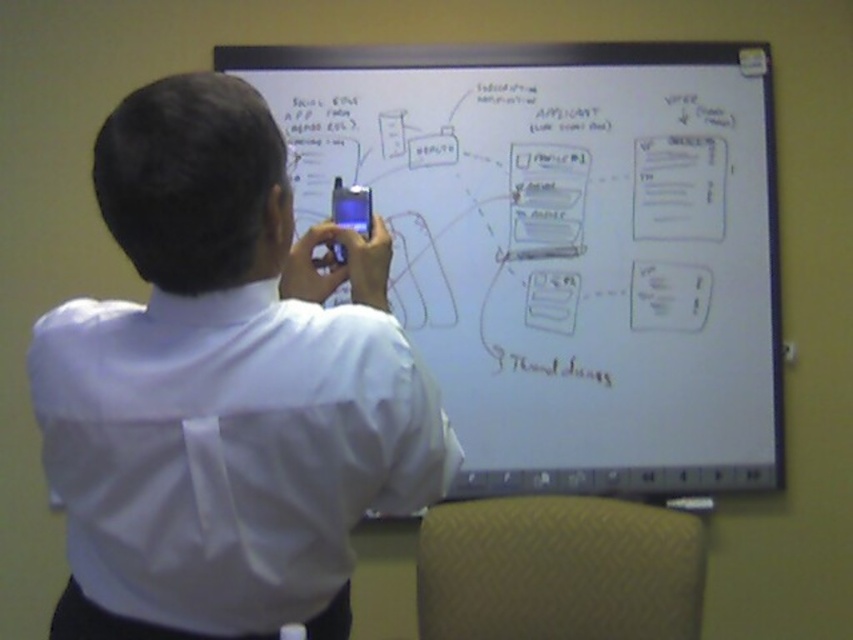
Question: Where is whiteboard at upper center located in relation to white smooth shirt at upper left in the image?

Choices:
 (A) below
 (B) above

Answer: (B)

Question: Which point is closer to the camera?

Choices:
 (A) (737, 342)
 (B) (349, 380)

Answer: (B)

Question: Which object appears closest to the camera in this image?

Choices:
 (A) white smooth shirt at upper left
 (B) whiteboard at upper center

Answer: (A)

Question: From the image, what is the correct spatial relationship of whiteboard at upper center in relation to white smooth shirt at upper left?

Choices:
 (A) right
 (B) left

Answer: (A)

Question: Is whiteboard at upper center below white smooth shirt at upper left?

Choices:
 (A) yes
 (B) no

Answer: (B)